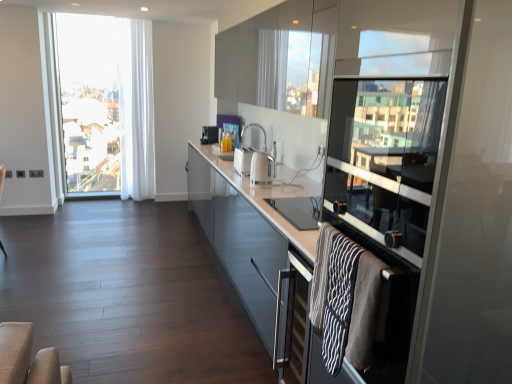
The height and width of the screenshot is (384, 512). Find the location of `free location in front of white sheer curtain at left`. free location in front of white sheer curtain at left is located at coordinates (132, 204).